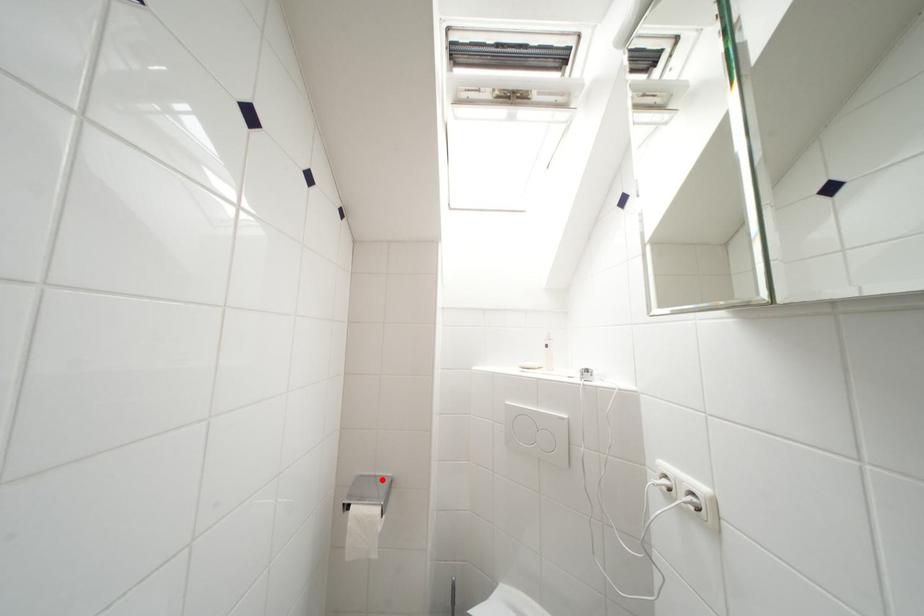
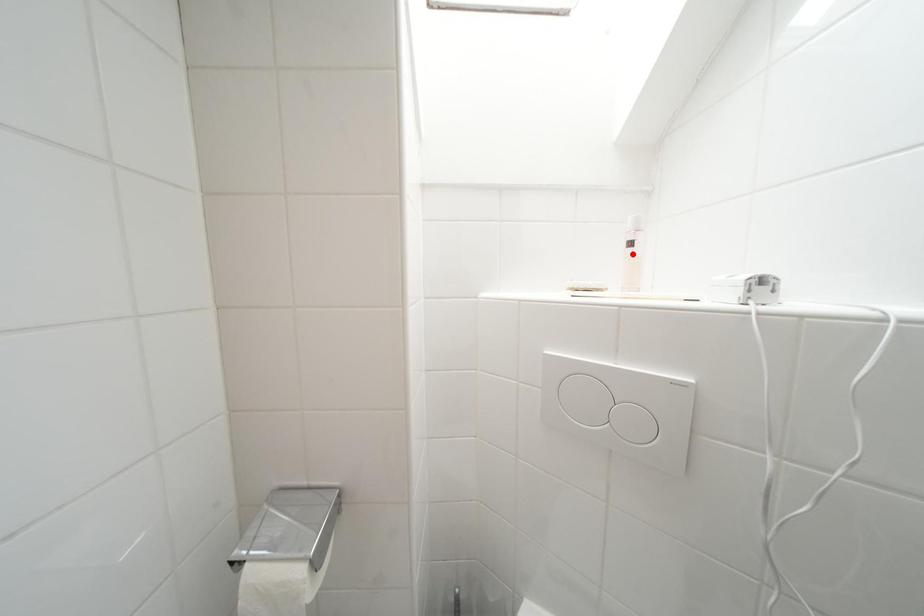
I am providing you with two images of the same scene from different viewpoints. A red point is marked on the first image and another point is marked on the second image. Is the red point in image1 aligned with the point shown in image2?

No